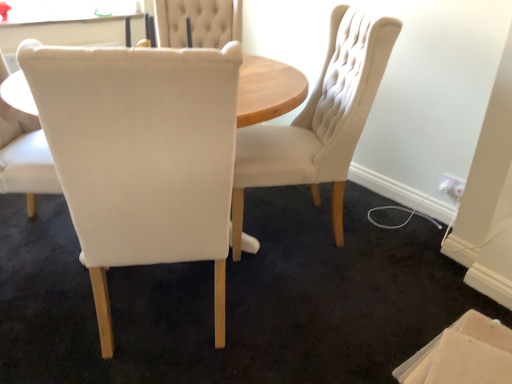
Locate an element on the screen. Image resolution: width=512 pixels, height=384 pixels. free region on the left part of matte white chair at center, the second chair when ordered from right to left is located at coordinates (47, 314).